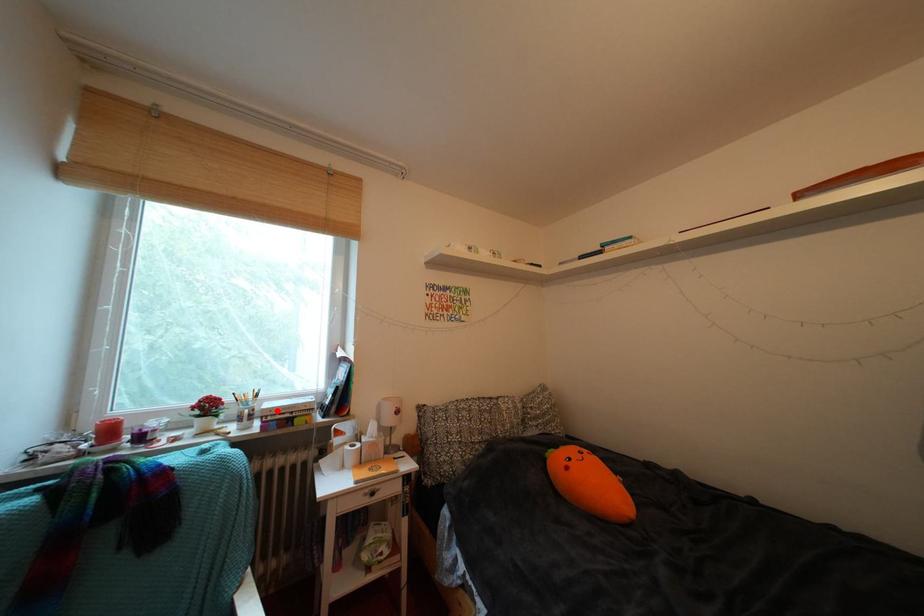
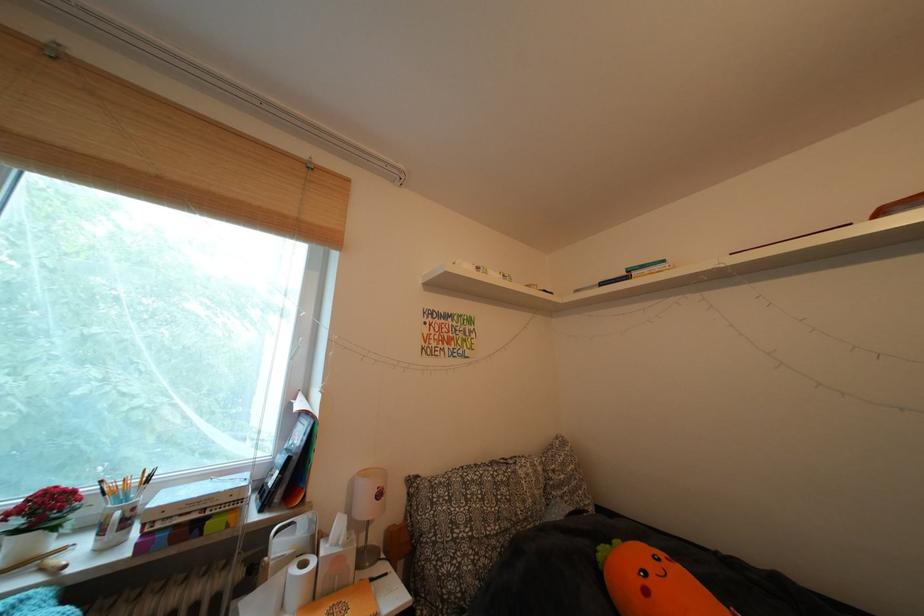
The point at the highlighted location is marked in the first image. Where is the corresponding point in the second image?

(172, 504)